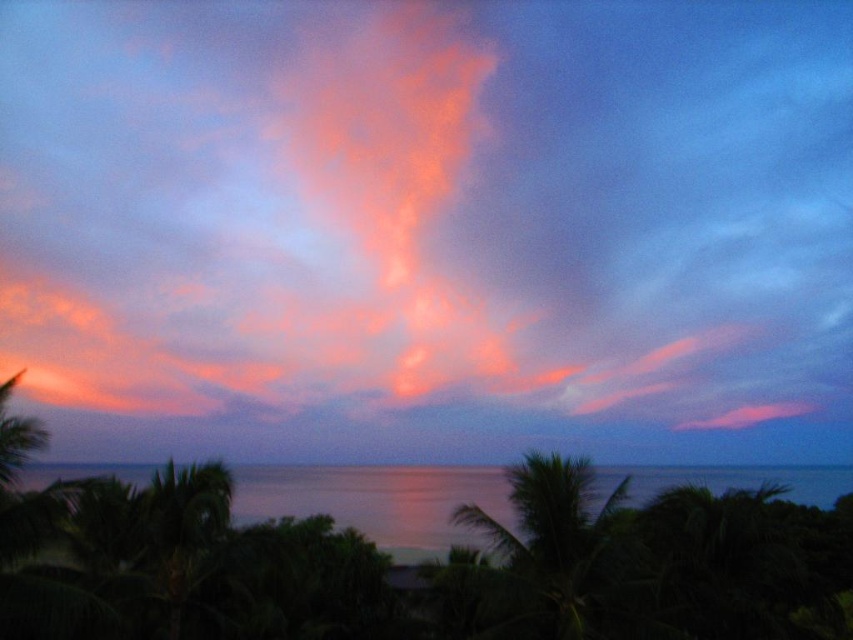
You are standing at the edge of the water in the sunset scene. There is a point marked at coordinates point (428, 227). Based on the scene, can you tell me what object this point is located on?

The point (428, 227) is located on the vivid orange cloud at center.

You are a photographer trying to capture the sunset. You notice the vivid orange cloud at center and the green leafy palm tree at center in your viewfinder. Which object is positioned more to the left?

The vivid orange cloud at center is positioned more to the left than the green leafy palm tree at center.